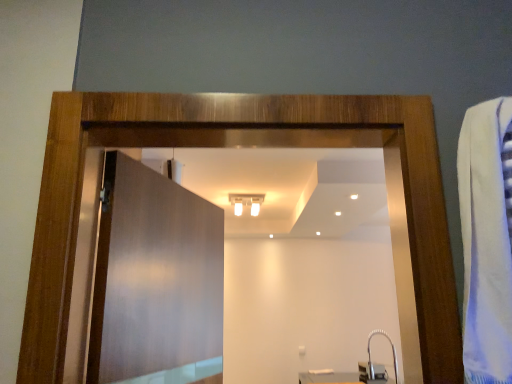
Question: Could white glossy light fixture at upper center be considered to be inside matte wood door at center?

Choices:
 (A) yes
 (B) no

Answer: (B)

Question: Does matte wood door at center have a greater width compared to white glossy light fixture at upper center?

Choices:
 (A) yes
 (B) no

Answer: (B)

Question: Does matte wood door at center have a lesser width compared to white glossy light fixture at upper center?

Choices:
 (A) no
 (B) yes

Answer: (B)

Question: From the image's perspective, does matte wood door at center appear lower than white glossy light fixture at upper center?

Choices:
 (A) no
 (B) yes

Answer: (B)

Question: Considering the relative positions of matte wood door at center and white glossy light fixture at upper center in the image provided, is matte wood door at center in front of white glossy light fixture at upper center?

Choices:
 (A) yes
 (B) no

Answer: (A)

Question: From the image's perspective, is matte wood door at center above or below satin nickel faucet at lower right?

Choices:
 (A) below
 (B) above

Answer: (B)

Question: Is matte wood door at center taller or shorter than satin nickel faucet at lower right?

Choices:
 (A) tall
 (B) short

Answer: (A)

Question: Considering the positions of matte wood door at center and satin nickel faucet at lower right in the image, is matte wood door at center wider or thinner than satin nickel faucet at lower right?

Choices:
 (A) thin
 (B) wide

Answer: (A)

Question: Which is correct: matte wood door at center is inside satin nickel faucet at lower right, or outside of it?

Choices:
 (A) outside
 (B) inside

Answer: (A)

Question: Is matte wood door at center in front of or behind white glossy light fixture at upper center in the image?

Choices:
 (A) behind
 (B) front

Answer: (B)

Question: In the image, is matte wood door at center on the left side or the right side of white glossy light fixture at upper center?

Choices:
 (A) left
 (B) right

Answer: (A)

Question: Is matte wood door at center situated inside white glossy light fixture at upper center or outside?

Choices:
 (A) outside
 (B) inside

Answer: (A)

Question: In terms of width, does matte wood door at center look wider or thinner when compared to white glossy light fixture at upper center?

Choices:
 (A) thin
 (B) wide

Answer: (A)

Question: From the image's perspective, is satin nickel faucet at lower right positioned above or below matte wood door at center?

Choices:
 (A) above
 (B) below

Answer: (B)

Question: Is point (394, 362) closer or farther from the camera than point (93, 301)?

Choices:
 (A) farther
 (B) closer

Answer: (A)